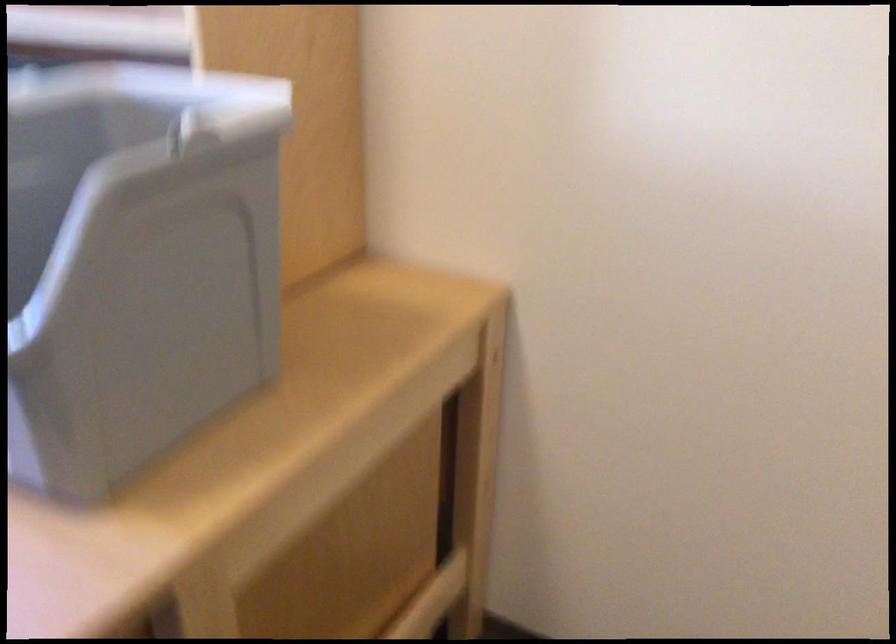
You are a GUI agent. You are given a task and a screenshot of the screen. Output one action in this format:
    pyautogui.click(x=<x>, y=<y>)
    Task: Click on the gray plastic bin
    
    Given the screenshot: What is the action you would take?
    pyautogui.click(x=135, y=263)